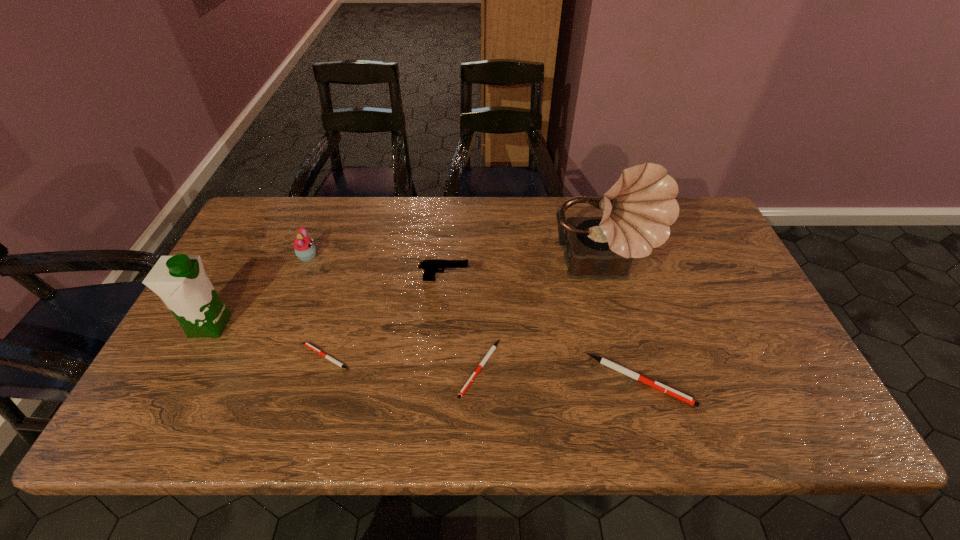
In order to click on soya milk in this screenshot , I will do `click(180, 281)`.

This screenshot has width=960, height=540. In order to click on pistol in this screenshot , I will do `click(432, 266)`.

Locate an element on the screen. vacant space located 0.270m on the clicker of the shortest pen is located at coordinates (188, 357).

The image size is (960, 540). I want to click on vacant region located 0.150m on the clicker of the shortest pen, so click(237, 357).

The image size is (960, 540). I want to click on free space located 0.210m on the clicker of the shortest pen, so click(212, 357).

Locate an element on the screen. vacant space located 0.110m on the clicker of the fifth tallest object is located at coordinates (736, 381).

Where is `free point located on the face of the cupcake`? The width and height of the screenshot is (960, 540). free point located on the face of the cupcake is located at coordinates (381, 257).

Find the location of a particular element. This screenshot has width=960, height=540. vacant space located from the horn of the tallest object is located at coordinates (630, 372).

This screenshot has width=960, height=540. Identify the location of vacant space located on the front-facing side of the second tallest object. (340, 325).

At what (x,y) coordinates should I click in order to perform the action: click on blank space located 0.290m on the front-facing side of the fourth tallest object. Please return your answer as a coordinate pair (x, y). Looking at the image, I should click on (571, 280).